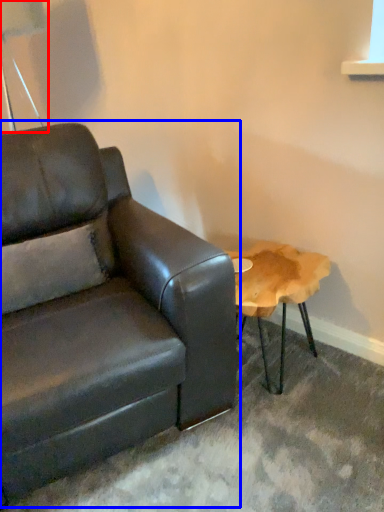
Question: Which object appears closest to the camera in this image, table lamp (highlighted by a red box) or studio couch (highlighted by a blue box)?

Choices:
 (A) table lamp
 (B) studio couch

Answer: (B)